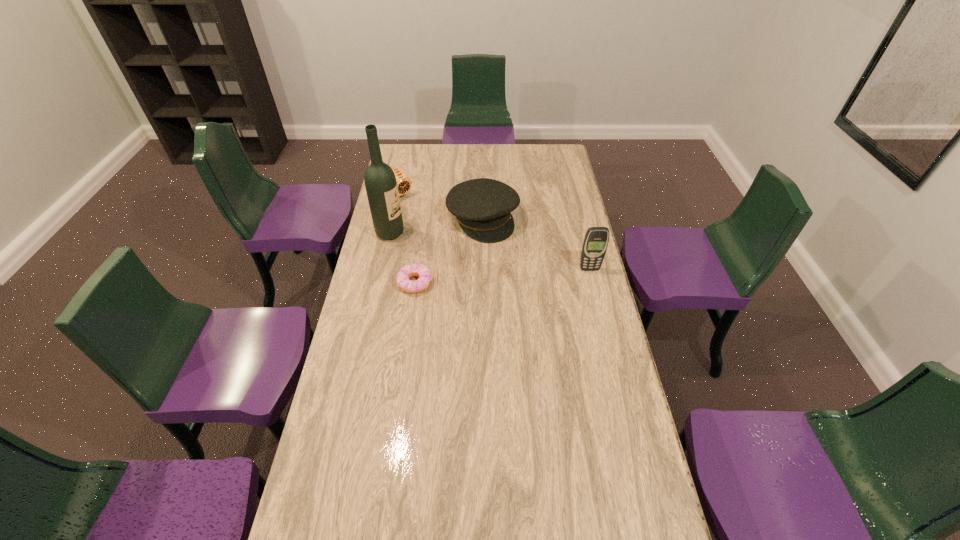
In order to click on free location located on the face of the watch in this screenshot , I will do `click(417, 209)`.

Locate an element on the screen. The width and height of the screenshot is (960, 540). vacant area located 0.340m on the front-facing side of the second object from right to left is located at coordinates (540, 296).

Where is `free space located on the front-facing side of the second object from right to left`? The image size is (960, 540). free space located on the front-facing side of the second object from right to left is located at coordinates (521, 271).

Image resolution: width=960 pixels, height=540 pixels. I want to click on vacant area located on the front-facing side of the second object from right to left, so tap(537, 291).

Locate an element on the screen. The height and width of the screenshot is (540, 960). free space located 0.390m on the labeled side of the wine bottle is located at coordinates (488, 264).

You are a GUI agent. You are given a task and a screenshot of the screen. Output one action in this format:
    pyautogui.click(x=<x>, y=<y>)
    Task: Click on the vacant area located 0.380m on the labeled side of the wine bottle
    
    Given the screenshot: What is the action you would take?
    pyautogui.click(x=485, y=263)

The height and width of the screenshot is (540, 960). I want to click on free spot located on the labeled side of the wine bottle, so click(436, 247).

You are a GUI agent. You are given a task and a screenshot of the screen. Output one action in this format:
    pyautogui.click(x=<x>, y=<y>)
    Task: Click on the doughnut at the left edge
    This screenshot has width=960, height=540.
    Given the screenshot: What is the action you would take?
    pyautogui.click(x=402, y=278)

Locate an element on the screen. watch that is at the left edge is located at coordinates tap(403, 182).

You are a GUI agent. You are given a task and a screenshot of the screen. Output one action in this format:
    pyautogui.click(x=<x>, y=<y>)
    Task: Click on the wine bottle present at the left edge
    Image resolution: width=960 pixels, height=540 pixels.
    Given the screenshot: What is the action you would take?
    pyautogui.click(x=381, y=186)